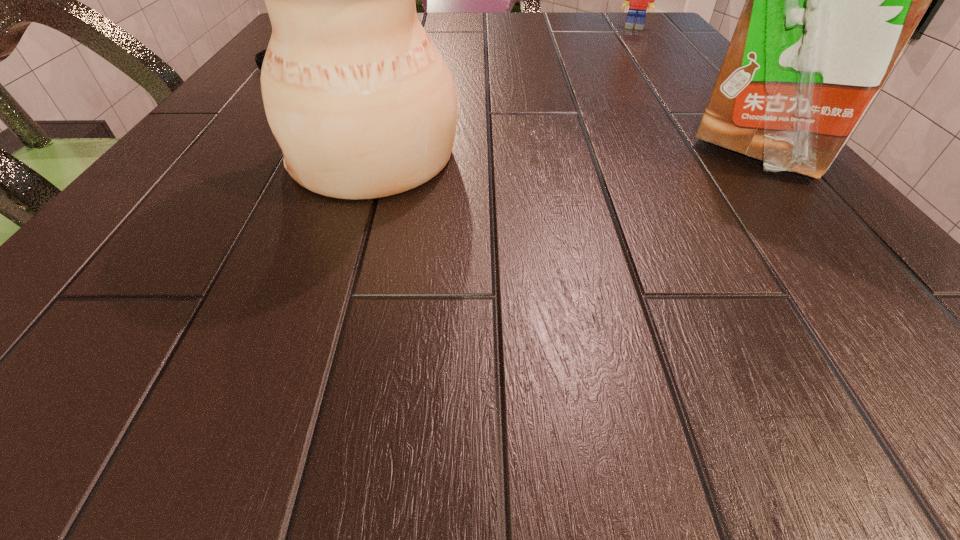
What are the coordinates of `free spot on the desktop that is between the pottery and the carton and is positioned on the display of the second farthest object` in the screenshot? It's located at (607, 152).

Locate an element on the screen. This screenshot has width=960, height=540. vacant spot on the desktop that is between the third object from right to left and the carton and is positioned on the front-facing side of the farthest object is located at coordinates (618, 151).